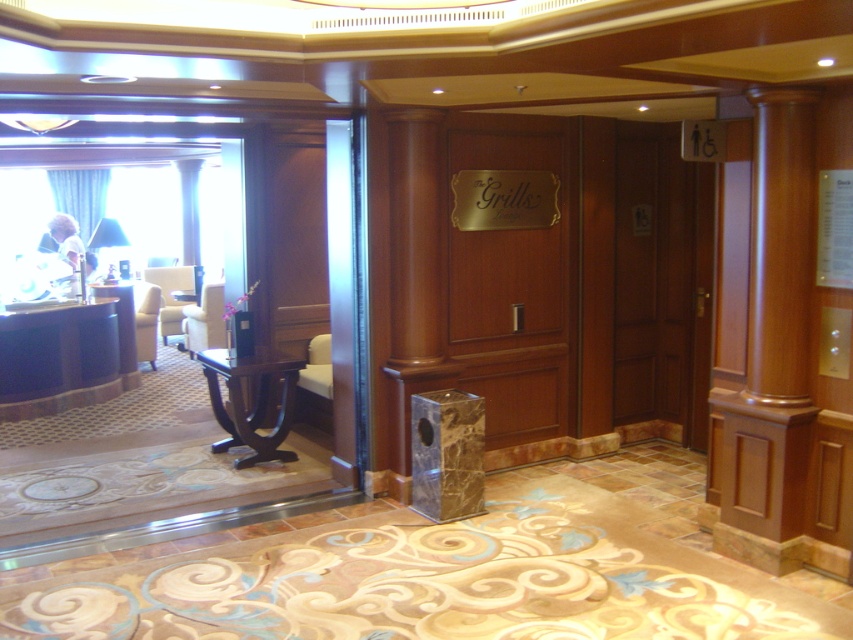
Is wooden elevator at center to the left of wooden column at right from the viewer's perspective?

Indeed, wooden elevator at center is positioned on the left side of wooden column at right.

Who is positioned more to the right, wooden elevator at center or wooden column at right?

wooden column at right is more to the right.

Is point (555, 316) farther from viewer compared to point (741, 499)?

That is True.

Locate an element on the screen. The height and width of the screenshot is (640, 853). wooden elevator at center is located at coordinates (549, 285).